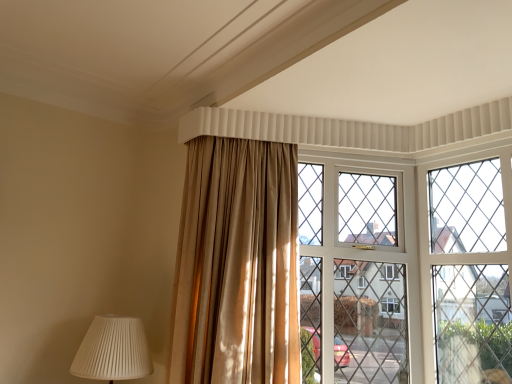
Question: From their relative heights in the image, would you say clear glass window at center is taller or shorter than satin gold curtain at center?

Choices:
 (A) short
 (B) tall

Answer: (B)

Question: Relative to satin gold curtain at center, is clear glass window at center in front or behind?

Choices:
 (A) front
 (B) behind

Answer: (B)

Question: Estimate the real-world distances between objects in this image. Which object is farther from the satin gold curtain at center?

Choices:
 (A) clear glass window at center
 (B) white pleated lampshade at lower left

Answer: (A)

Question: Which is farther from the white pleated lampshade at lower left?

Choices:
 (A) satin gold curtain at center
 (B) clear glass window at center

Answer: (B)